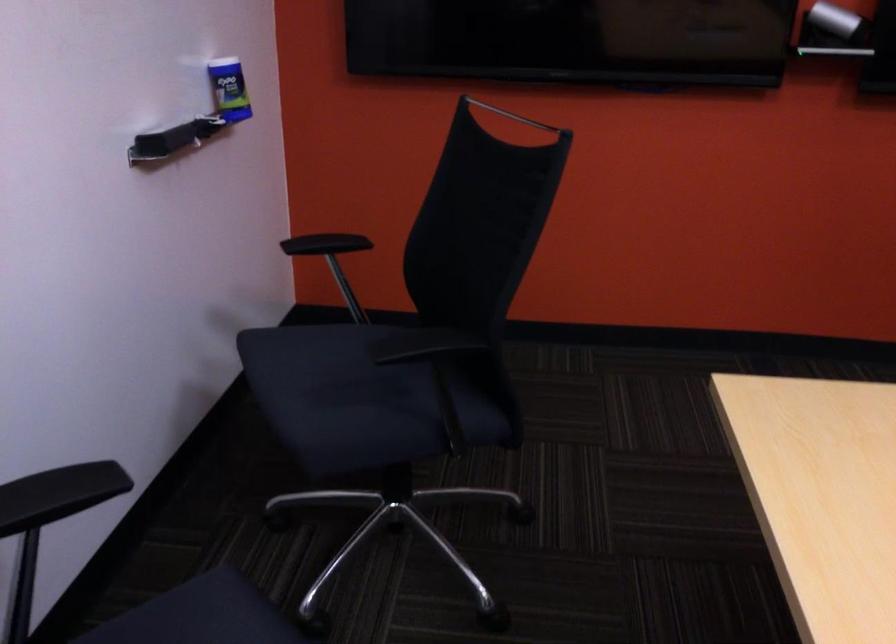
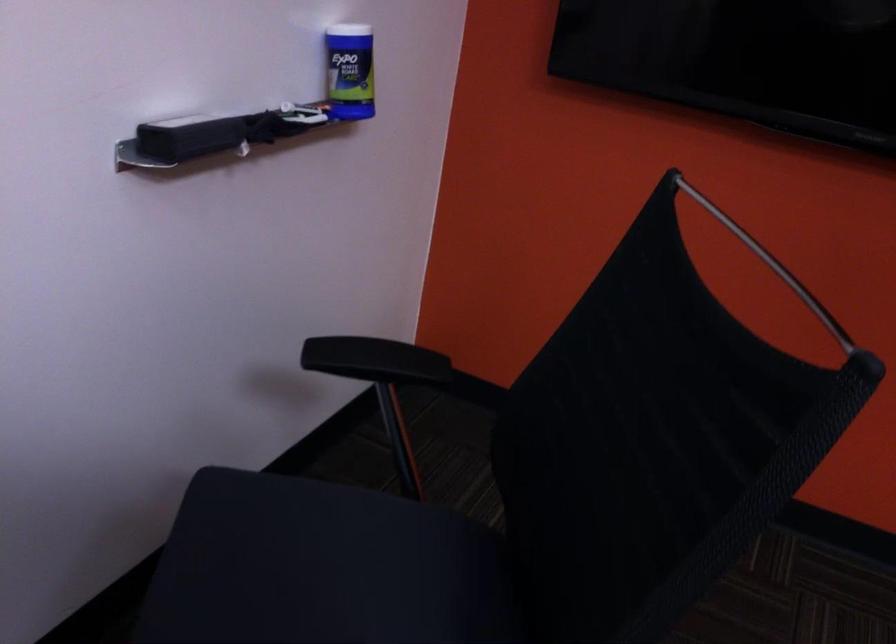
Question: What movement of the cameraman would produce the second image?

Choices:
 (A) Left
 (B) Right
 (C) Forward
 (D) Backward

Answer: (C)